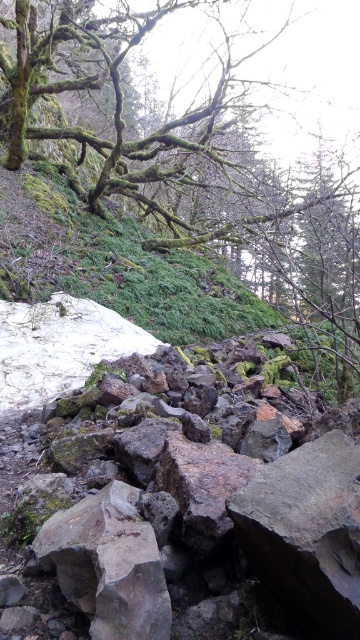
You are standing at the edge of the scene and want to take a photo of the gray rough rocks at lower center. If your camera can focus on objects within 5 feet, will you need to move closer or farther away to capture them clearly?

The gray rough rocks at lower center are 6.28 feet away from the camera. Since your camera can focus within 5 feet, you need to move closer to ensure they are within the focus range.

You are a hiker trying to navigate through the rocky terrain. You see a green mossy branch at upper left and a gray rough rock at center. Which object is taller?

The green mossy branch at upper left is much taller than the gray rough rock at center.

You are standing at the edge of the slope and want to pick up a gray rough rock. Which one is easier to reach, the gray rough rocks at lower center or the gray rough rock at center?

The gray rough rocks at lower center is closer to the viewer than the gray rough rock at center, so it is easier to reach.